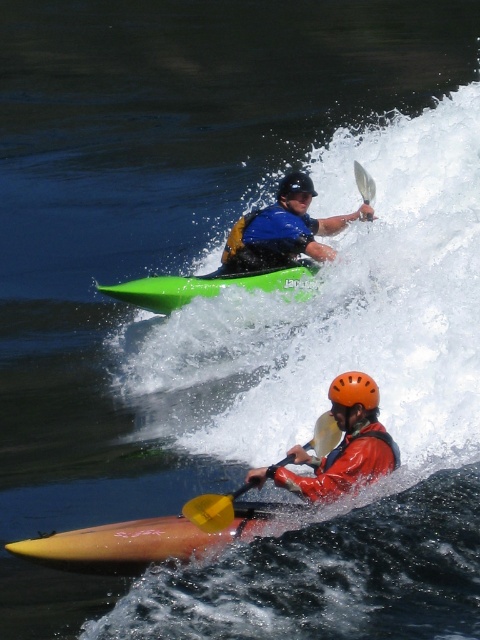
Question: Does black matte helmet at upper center have a lesser width compared to white plastic paddle at upper center?

Choices:
 (A) yes
 (B) no

Answer: (B)

Question: Is green matte kayak at upper center thinner than orange matte helmet at lower center?

Choices:
 (A) yes
 (B) no

Answer: (B)

Question: Which point is farther from the camera taking this photo?

Choices:
 (A) 299,192
 (B) 265,220
 (C) 217,278

Answer: (B)

Question: Is orange matte helmet at center in front of blue matte life jacket at center?

Choices:
 (A) yes
 (B) no

Answer: (A)

Question: Which point appears closest to the camera in this image?

Choices:
 (A) click(120, 300)
 (B) click(336, 396)

Answer: (B)

Question: Which of the following is the farthest from the observer?

Choices:
 (A) (179, 282)
 (B) (71, 536)
 (C) (359, 172)
 (D) (324, 433)

Answer: (C)